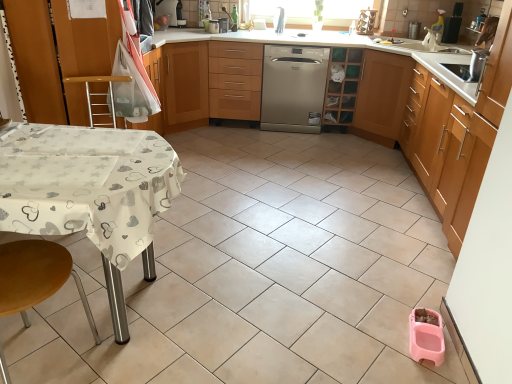
Question: Is wooden step stool at lower left, the second step stool from the back, touching white fabric-covered table at lower left?

Choices:
 (A) no
 (B) yes

Answer: (A)

Question: From the image's perspective, is wooden step stool at lower left, placed as the first step stool when sorted from front to back, on white fabric-covered table at lower left?

Choices:
 (A) no
 (B) yes

Answer: (A)

Question: Is wooden step stool at lower left, the second step stool in the top-to-bottom sequence, to the right of white fabric-covered table at lower left from the viewer's perspective?

Choices:
 (A) no
 (B) yes

Answer: (B)

Question: Is wooden step stool at lower left, the second step stool in the top-to-bottom sequence, taller than white fabric-covered table at lower left?

Choices:
 (A) no
 (B) yes

Answer: (B)

Question: Is wooden step stool at lower left, the second step stool from the back, not close to white fabric-covered table at lower left?

Choices:
 (A) yes
 (B) no

Answer: (B)

Question: Is wooden drawer at center inside or outside of brushed metal coffee machine at upper center, positioned as the 3th appliance in right-to-left order?

Choices:
 (A) inside
 (B) outside

Answer: (B)

Question: In terms of height, does wooden drawer at center look taller or shorter compared to brushed metal coffee machine at upper center, the first appliance positioned from the left?

Choices:
 (A) tall
 (B) short

Answer: (A)

Question: Considering the positions of wooden drawer at center and brushed metal coffee machine at upper center, the first appliance positioned from the left, in the image, is wooden drawer at center wider or thinner than brushed metal coffee machine at upper center, the first appliance positioned from the left,?

Choices:
 (A) thin
 (B) wide

Answer: (B)

Question: Is wooden drawer at center in front of or behind brushed metal coffee machine at upper center, positioned as the 3th appliance in right-to-left order, in the image?

Choices:
 (A) behind
 (B) front

Answer: (B)

Question: From a real-world perspective, is white fabric-covered table at lower left positioned above or below metallic silver toaster at upper center, which appears as the 2th appliance when viewed from the right?

Choices:
 (A) below
 (B) above

Answer: (A)

Question: From the image's perspective, is white fabric-covered table at lower left above or below metallic silver toaster at upper center, which appears as the 2th appliance when viewed from the right?

Choices:
 (A) below
 (B) above

Answer: (A)

Question: Considering the positions of white fabric-covered table at lower left and metallic silver toaster at upper center, the second appliance positioned from the left, in the image, is white fabric-covered table at lower left bigger or smaller than metallic silver toaster at upper center, the second appliance positioned from the left,?

Choices:
 (A) small
 (B) big

Answer: (B)

Question: Is white fabric-covered table at lower left wider or thinner than metallic silver toaster at upper center, the second appliance positioned from the left?

Choices:
 (A) wide
 (B) thin

Answer: (A)

Question: Relative to light brown wood cabinet at right, marked as the first cabinetry in a right-to-left arrangement, is metallic silver toaster at upper center, which appears as the 2th appliance when viewed from the right, in front or behind?

Choices:
 (A) behind
 (B) front

Answer: (A)

Question: From their relative heights in the image, would you say metallic silver toaster at upper center, which appears as the 2th appliance when viewed from the right, is taller or shorter than light brown wood cabinet at right, marked as the first cabinetry in a right-to-left arrangement?

Choices:
 (A) tall
 (B) short

Answer: (B)